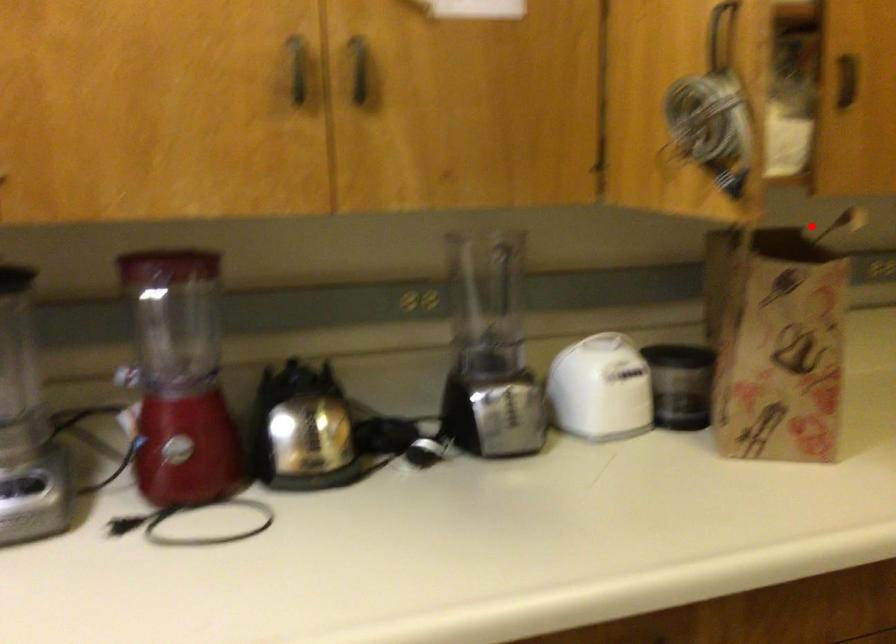
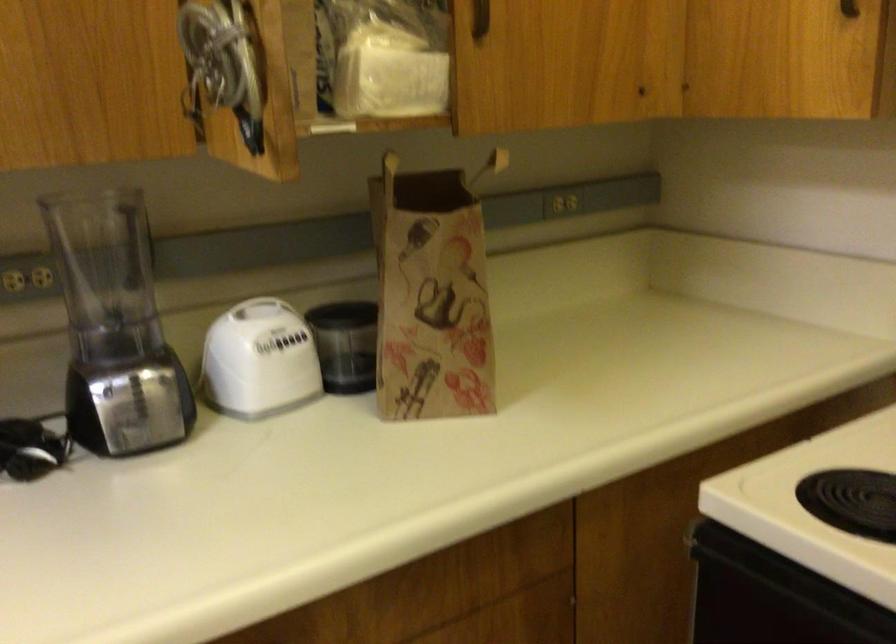
In the second image, find the point that corresponds to the highlighted location in the first image.

(489, 166)